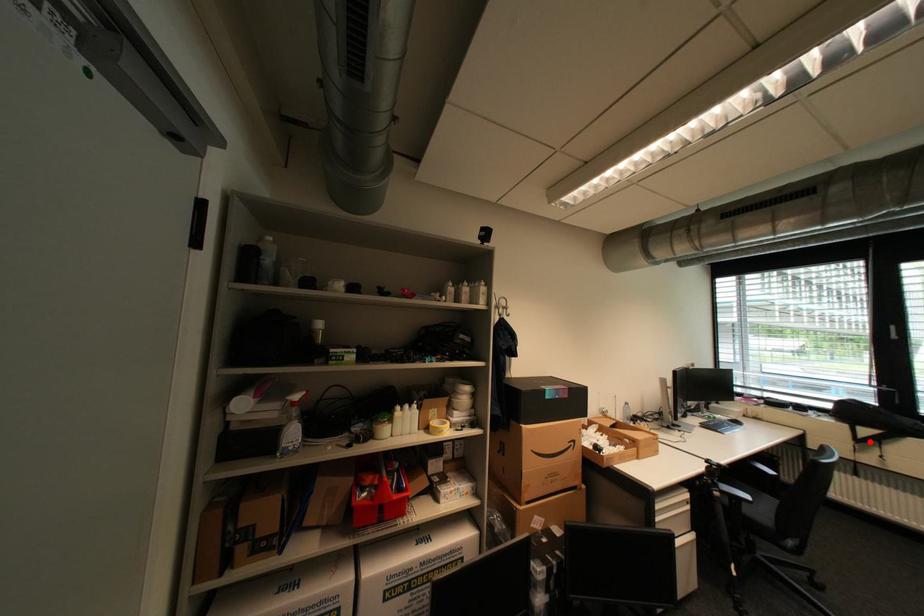
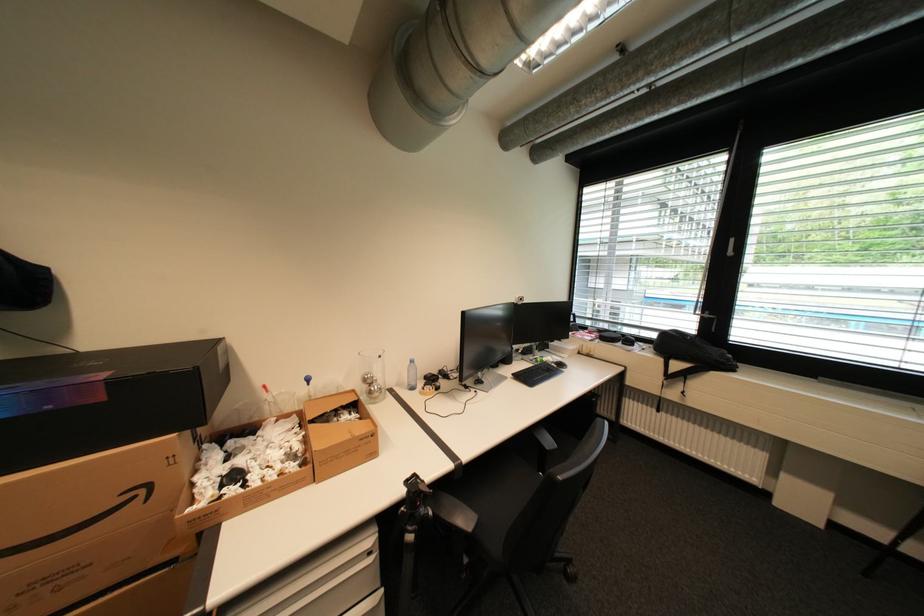
Question: A red point is marked in image1. In image2, is the corresponding 3D point closer to the camera or farther? Reply with the corresponding letter.

Choices:
 (A) The corresponding 3D point is closer.
 (B) The corresponding 3D point is farther.

Answer: (B)